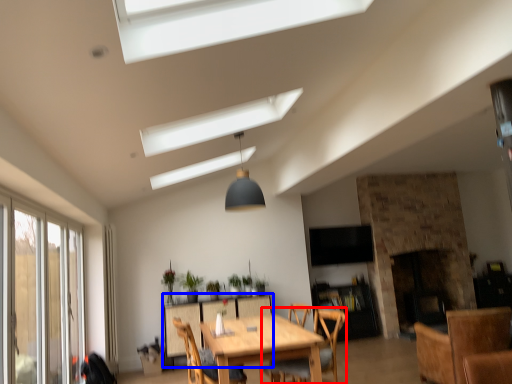
Question: Which object is further to the camera taking this photo, chair (highlighted by a red box) or table (highlighted by a blue box)?

Choices:
 (A) chair
 (B) table

Answer: (B)